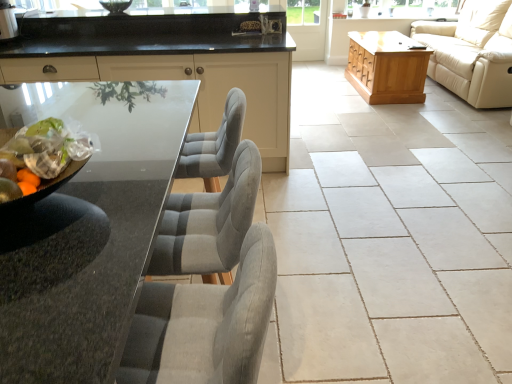
Question: Is light brown wooden chest at right taller or shorter than transparent glass screen door at center?

Choices:
 (A) short
 (B) tall

Answer: (A)

Question: Considering the positions of point (350, 69) and point (295, 54), is point (350, 69) closer or farther from the camera than point (295, 54)?

Choices:
 (A) farther
 (B) closer

Answer: (B)

Question: Which object is the closest to the beige leather couch at right?

Choices:
 (A) light brown wooden chest at right
 (B) beige ceramic tile at center
 (C) matte black cabinetry at center
 (D) transparent glass screen door at center
 (E) metallic silver toaster at upper left

Answer: (A)

Question: Considering the real-world distances, which object is farthest from the translucent plastic bag of mixed fruits at left?

Choices:
 (A) transparent glass screen door at center
 (B) metallic silver toaster at upper left
 (C) beige ceramic tile at center
 (D) light brown wooden chest at right
 (E) matte black cabinetry at center

Answer: (A)